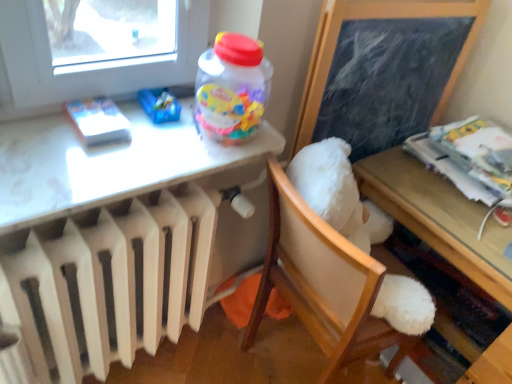
Question: Does white glossy table at upper left, which ranks as the first table in left-to-right order, come behind printed paper stack at right, placed as the second magazine when sorted from left to right?

Choices:
 (A) no
 (B) yes

Answer: (A)

Question: Is white glossy table at upper left, which appears as the 2th table when viewed from the right, directly adjacent to printed paper stack at right, which ranks as the first magazine in right-to-left order?

Choices:
 (A) yes
 (B) no

Answer: (B)

Question: Is white glossy table at upper left, which appears as the 2th table when viewed from the right, facing away from printed paper stack at right, which ranks as the 1th magazine in back-to-front order?

Choices:
 (A) no
 (B) yes

Answer: (A)

Question: Does white glossy table at upper left, which appears as the 2th table when viewed from the right, appear on the right side of printed paper stack at right, which is the second magazine in front-to-back order?

Choices:
 (A) no
 (B) yes

Answer: (A)

Question: Is printed paper stack at right, which ranks as the 1th magazine in back-to-front order, completely or partially inside white glossy table at upper left, which ranks as the first table in left-to-right order?

Choices:
 (A) no
 (B) yes

Answer: (A)

Question: Can you confirm if white glossy table at upper left, which ranks as the first table in left-to-right order, is smaller than printed paper stack at right, which ranks as the first magazine in right-to-left order?

Choices:
 (A) yes
 (B) no

Answer: (A)

Question: Is black chalkboard at upper right positioned behind white glossy table at upper left, which appears as the 2th table when viewed from the right?

Choices:
 (A) no
 (B) yes

Answer: (B)

Question: Are black chalkboard at upper right and white glossy table at upper left, which ranks as the first table in left-to-right order, far apart?

Choices:
 (A) no
 (B) yes

Answer: (A)

Question: Could white glossy table at upper left, which ranks as the first table in left-to-right order, be considered to be inside black chalkboard at upper right?

Choices:
 (A) no
 (B) yes

Answer: (A)

Question: Does black chalkboard at upper right appear on the right side of white glossy table at upper left, which appears as the 2th table when viewed from the right?

Choices:
 (A) no
 (B) yes

Answer: (B)

Question: Does black chalkboard at upper right touch white glossy table at upper left, which ranks as the first table in left-to-right order?

Choices:
 (A) no
 (B) yes

Answer: (A)

Question: Is black chalkboard at upper right to the left of white glossy table at upper left, which appears as the 2th table when viewed from the right, from the viewer's perspective?

Choices:
 (A) yes
 (B) no

Answer: (B)

Question: Does wooden table at lower right, the 1th table viewed from the right, appear on the left side of white matte book at upper left, marked as the first magazine in a front-to-back arrangement?

Choices:
 (A) yes
 (B) no

Answer: (B)